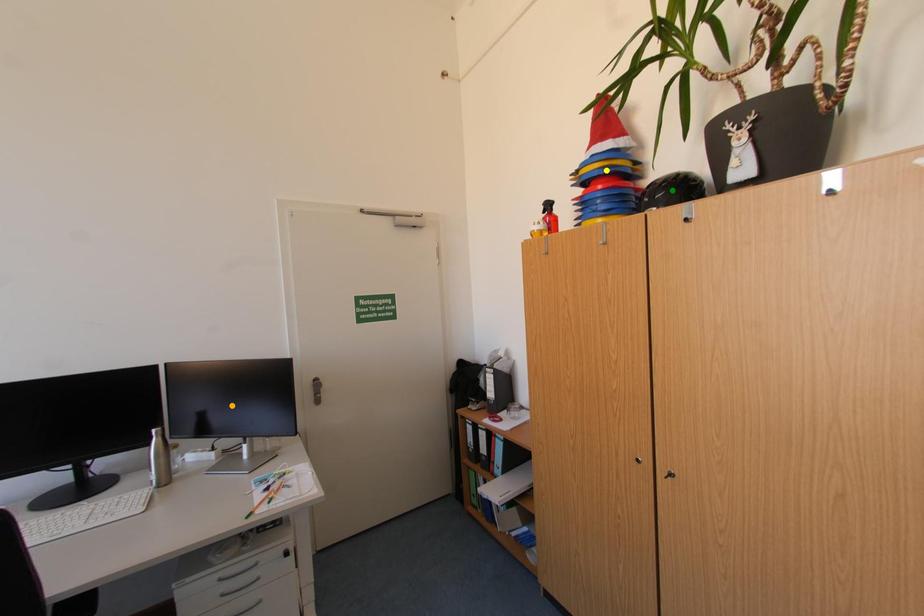
Order these from nearest to farthest:
- orange point
- yellow point
- green point

1. green point
2. yellow point
3. orange point